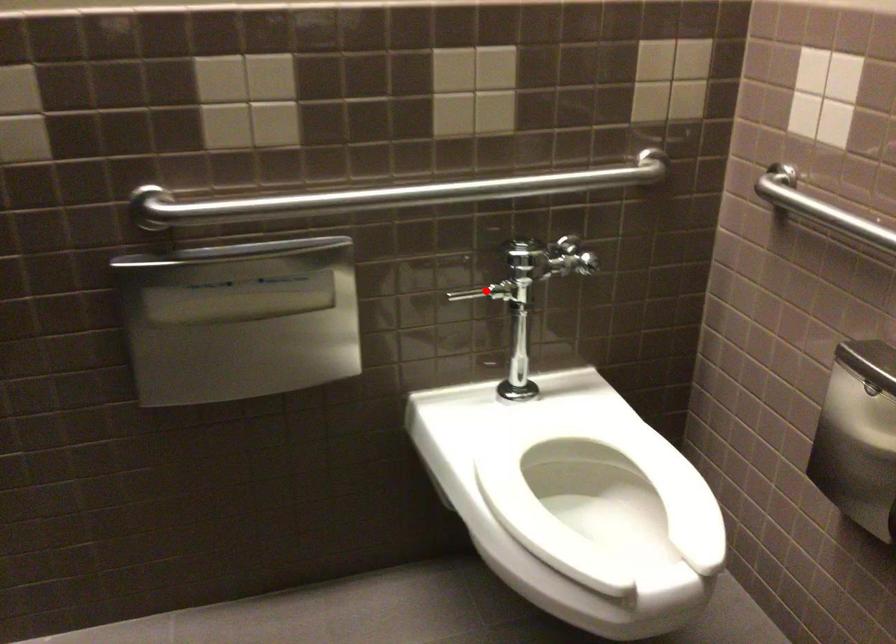
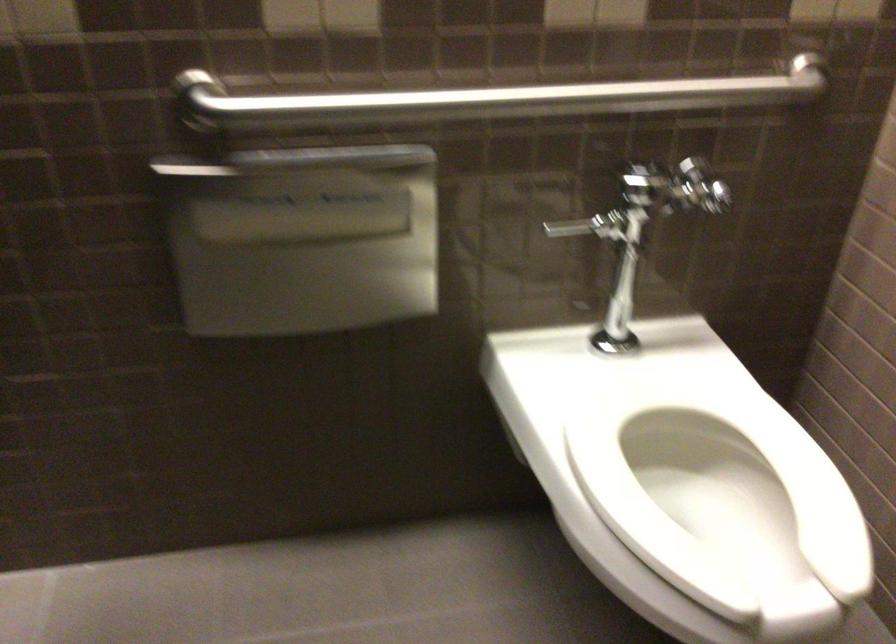
Question: I am providing you with two images of the same scene from different viewpoints. A red point is shown in image1. For the corresponding object point in image2, is it positioned nearer or farther from the camera?

Choices:
 (A) Nearer
 (B) Farther

Answer: (A)